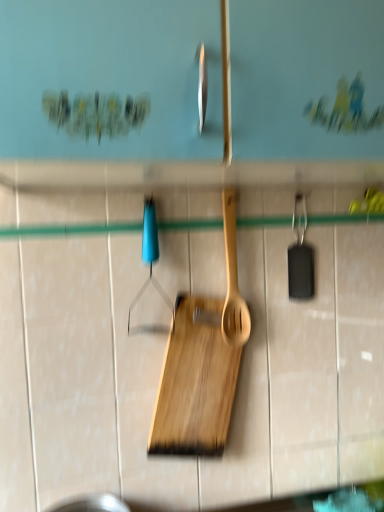
What do you see at coordinates (150, 255) in the screenshot? This screenshot has height=512, width=384. I see `blue plastic hanger at center` at bounding box center [150, 255].

Locate an element on the screen. natural wood cutting board at center is located at coordinates (195, 382).

From a real-world perspective, between blue plastic hanger at center and natural wood cutting board at center, who is vertically higher?

From a 3D spatial view, blue plastic hanger at center is above.

Is blue plastic hanger at center positioned in front of natural wood cutting board at center?

No, blue plastic hanger at center is further to the viewer.

Is natural wood cutting board at center surrounded by blue plastic hanger at center?

That's incorrect, natural wood cutting board at center is not inside blue plastic hanger at center.

Could you tell me if blue plastic hanger at center is turned towards natural wood cutting board at center?

No, blue plastic hanger at center is not facing towards natural wood cutting board at center.

Are natural wood cutting board at center and wooden spatula at center making contact?

They are not placed beside each other.

Considering the sizes of objects natural wood cutting board at center and wooden spatula at center in the image provided, who is taller, natural wood cutting board at center or wooden spatula at center?

natural wood cutting board at center is taller.

Do you think natural wood cutting board at center is within wooden spatula at center, or outside of it?

natural wood cutting board at center lies outside wooden spatula at center.

Between natural wood cutting board at center and wooden spatula at center, which one is positioned in front?

natural wood cutting board at center is closer to the camera.

How much distance is there between blue plastic hanger at center and wooden spatula at center?

They are 13.42 centimeters apart.

Does blue plastic hanger at center have a greater width compared to wooden spatula at center?

Correct, the width of blue plastic hanger at center exceeds that of wooden spatula at center.

Is blue plastic hanger at center oriented away from wooden spatula at center?

No.

What's the angular difference between blue plastic hanger at center and wooden spatula at center's facing directions?

The angle between the facing direction of blue plastic hanger at center and the facing direction of wooden spatula at center is 1.54 degrees.

Between wooden spatula at center and natural wood cutting board at center, which one has larger size?

natural wood cutting board at center is bigger.

Is wooden spatula at center positioned before natural wood cutting board at center?

No, the depth of wooden spatula at center is greater than that of natural wood cutting board at center.

Looking at this image, how far apart are wooden spatula at center and natural wood cutting board at center?

wooden spatula at center and natural wood cutting board at center are 10.50 centimeters apart from each other.

This screenshot has height=512, width=384. I want to click on cutting board on the left of wooden spatula at center, so click(195, 382).

Could you tell me if natural wood cutting board at center is facing blue plastic hanger at center?

No, natural wood cutting board at center does not turn towards blue plastic hanger at center.

In the scene shown: Does natural wood cutting board at center have a greater width compared to blue plastic hanger at center?

Indeed, natural wood cutting board at center has a greater width compared to blue plastic hanger at center.

You are a GUI agent. You are given a task and a screenshot of the screen. Output one action in this format:
    pyautogui.click(x=<x>, y=<y>)
    Task: Click on the hanger behind the natural wood cutting board at center
    The image size is (384, 512).
    Given the screenshot: What is the action you would take?
    pyautogui.click(x=150, y=255)

Consider the image. Is the depth of wooden spatula at center greater than that of blue plastic hanger at center?

Yes, wooden spatula at center is behind blue plastic hanger at center.

From a real-world perspective, is wooden spatula at center below blue plastic hanger at center?

Yes.

Does wooden spatula at center turn towards blue plastic hanger at center?

No, wooden spatula at center does not turn towards blue plastic hanger at center.

Between wooden spatula at center and blue plastic hanger at center, which one has larger width?

blue plastic hanger at center is wider.

This screenshot has height=512, width=384. Find the location of `hanger above the natural wood cutting board at center (from a real-world perspective)`. hanger above the natural wood cutting board at center (from a real-world perspective) is located at coordinates (150, 255).

Identify the location of cutting board in front of the wooden spatula at center. The height and width of the screenshot is (512, 384). (195, 382).

Looking at the image, which one is located closer to natural wood cutting board at center, wooden spatula at center or blue plastic hanger at center?

wooden spatula at center.

Based on their spatial positions, is blue plastic hanger at center or natural wood cutting board at center closer to wooden spatula at center?

natural wood cutting board at center is closer to wooden spatula at center.

From the image, which object appears to be farther from wooden spatula at center, natural wood cutting board at center or blue plastic hanger at center?

The object further to wooden spatula at center is blue plastic hanger at center.

In the scene shown: When comparing their distances from natural wood cutting board at center, does blue plastic hanger at center or wooden spatula at center seem closer?

wooden spatula at center.

Looking at the image, which one is located further to blue plastic hanger at center, wooden spatula at center or natural wood cutting board at center?

natural wood cutting board at center is further to blue plastic hanger at center.

From the image, which object appears to be farther from blue plastic hanger at center, natural wood cutting board at center or wooden spatula at center?

natural wood cutting board at center.

Where is `spatula between blue plastic hanger at center and natural wood cutting board at center from top to bottom`? This screenshot has width=384, height=512. spatula between blue plastic hanger at center and natural wood cutting board at center from top to bottom is located at coordinates (233, 280).